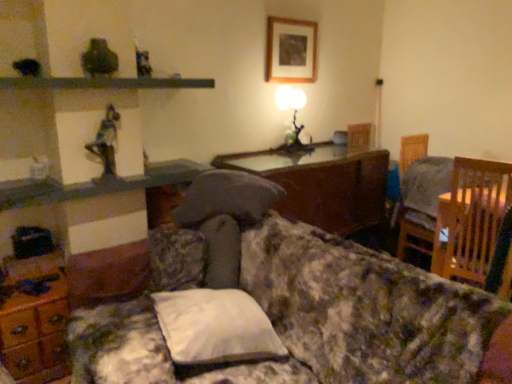
Question: Would you say wooden glossy table at center is to the left or to the right of matte glass table lamp at center in the picture?

Choices:
 (A) left
 (B) right

Answer: (B)

Question: Is point (345, 231) closer or farther from the camera than point (288, 87)?

Choices:
 (A) farther
 (B) closer

Answer: (B)

Question: Estimate the real-world distances between objects in this image. Which object is farther from the white fabric pillow at center?

Choices:
 (A) floral fabric couch at center
 (B) matte glass table lamp at center
 (C) wooden picture frame at upper center
 (D) wooden glossy table at center
 (E) wooden chair at right

Answer: (C)

Question: Considering the real-world distances, which object is farthest from the metallic statue at upper left?

Choices:
 (A) wooden glossy table at center
 (B) floral fabric couch at center
 (C) white fabric pillow at center
 (D) wooden dresser at lower left
 (E) wooden picture frame at upper center

Answer: (E)